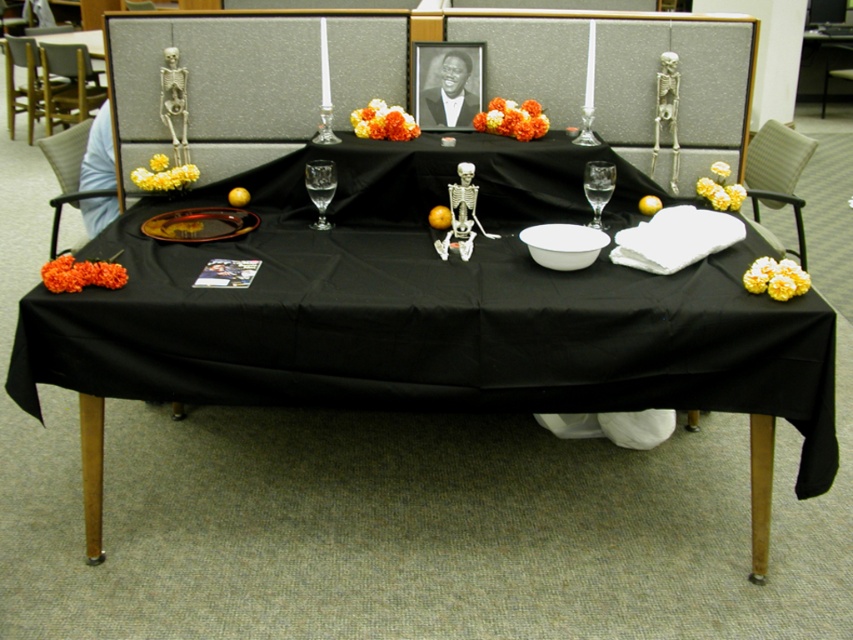
You are standing at the end of the table and want to place a small token on the metallic silver picture frame at center. To ensure you place it correctly, which direction should you move your hand from the transparent glass wine glass at center?

You should move your hand to the right from the transparent glass wine glass at center to reach the metallic silver picture frame at center, as the metallic silver picture frame at center is positioned to the right of the transparent glass wine glass at center.

You are setting up a memorial display and need to place a decorative item between the shiny metallic platter at center and the transparent glass wine glass at center. Which object should you place the item next to if you want it to be closer to the wider object?

You should place the item next to the shiny metallic platter at center because its width surpasses that of the transparent glass wine glass at center.